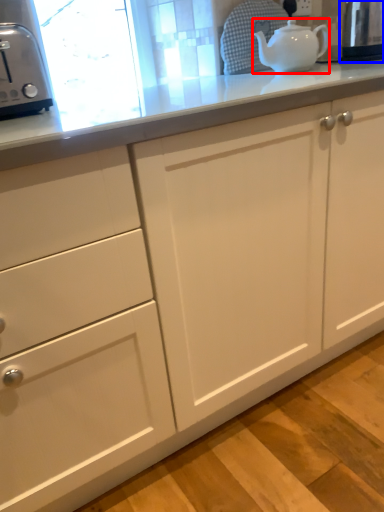
Question: Which of the following is the closest to the observer, teapot (highlighted by a red box) or appliance (highlighted by a blue box)?

Choices:
 (A) teapot
 (B) appliance

Answer: (A)